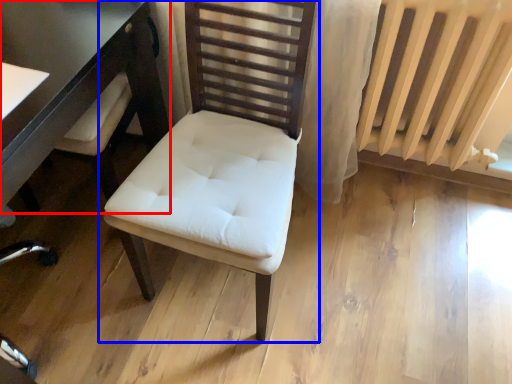
Question: Which of the following is the farthest to the observer, table (highlighted by a red box) or chair (highlighted by a blue box)?

Choices:
 (A) table
 (B) chair

Answer: (A)